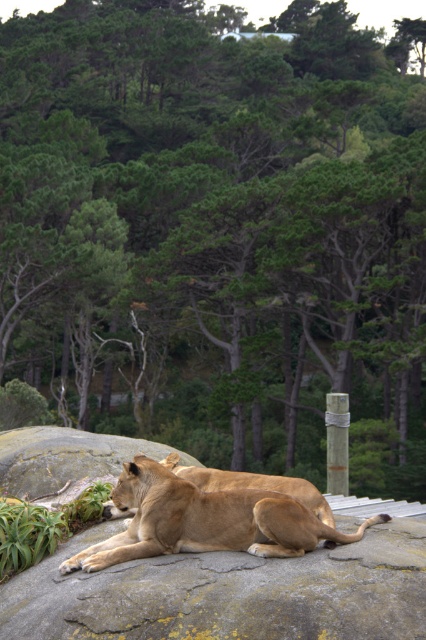
Question: Is golden fur lion at center wider than metallic gray pole at center right?

Choices:
 (A) yes
 (B) no

Answer: (A)

Question: Which of the following is the farthest from the observer?

Choices:
 (A) golden fur lion at center
 (B) metallic gray pole at center right

Answer: (B)

Question: Is golden fur lion at center smaller than metallic gray pole at center right?

Choices:
 (A) yes
 (B) no

Answer: (B)

Question: Can you confirm if golden fur lion at center is positioned to the right of metallic gray pole at center right?

Choices:
 (A) yes
 (B) no

Answer: (B)

Question: Among these objects, which one is nearest to the camera?

Choices:
 (A) golden fur lion at center
 (B) metallic gray pole at center right

Answer: (A)